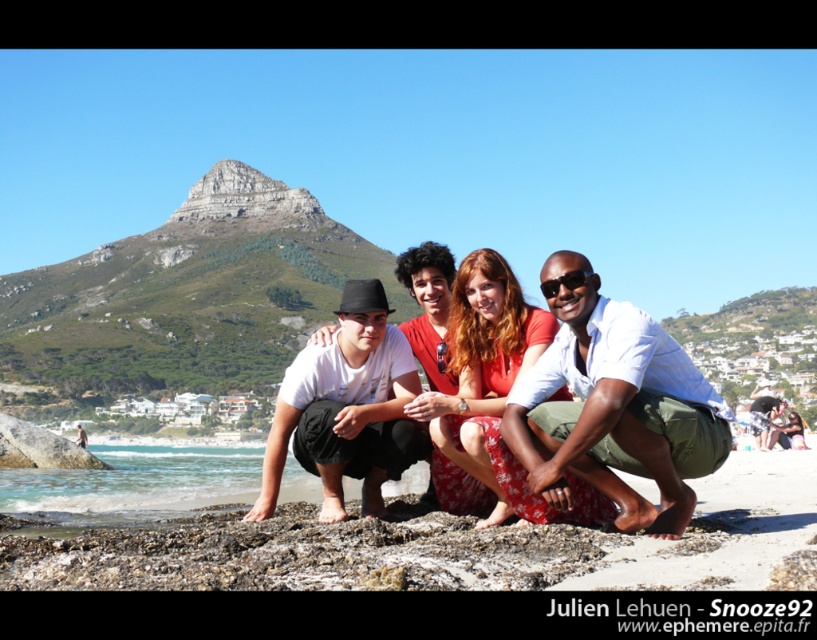
Question: Which of the following is the closest to the observer?

Choices:
 (A) (594, 273)
 (B) (248, 513)

Answer: (A)

Question: Can you confirm if smooth sand at center is positioned to the right of floral cotton dress at center?

Choices:
 (A) yes
 (B) no

Answer: (B)

Question: Is floral cotton dress at center above matte white t-shirt at center?

Choices:
 (A) no
 (B) yes

Answer: (B)

Question: Which object is the farthest from the black plastic sunglasses at center?

Choices:
 (A) smooth sand at center
 (B) white cotton shirt at center
 (C) matte white t-shirt at center
 (D) white matte shirt at center

Answer: (A)

Question: Which of the following is the closest to the observer?

Choices:
 (A) black plastic sunglasses at center
 (B) floral cotton dress at center
 (C) matte white t-shirt at center

Answer: (B)

Question: Can you confirm if floral cotton dress at center is smaller than matte white t-shirt at center?

Choices:
 (A) yes
 (B) no

Answer: (A)